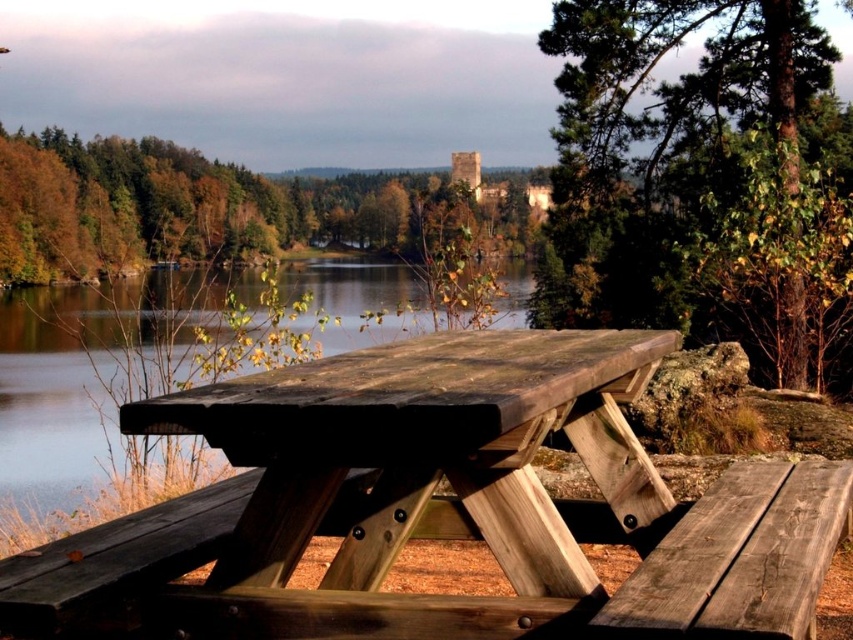
You are planning to take a photo of the green rough bark tree at upper right and the brown wooden lake at center. Which object will appear wider in the photo?

The brown wooden lake at center will appear wider in the photo because its width is greater than that of the green rough bark tree at upper right.

You are sitting at the weathered wood bench at lower right and looking towards the green leafy tree at upper center. Can you see the top of the tree from your current position?

Yes, the green leafy tree at upper center is above the weathered wood bench at lower right, so you can see the top of the tree from your current position.